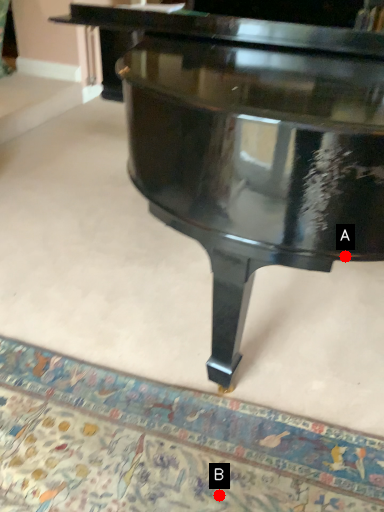
Question: Two points are circled on the image, labeled by A and B beside each circle. Which point is farther from the camera taking this photo?

Choices:
 (A) A is further
 (B) B is further

Answer: (B)